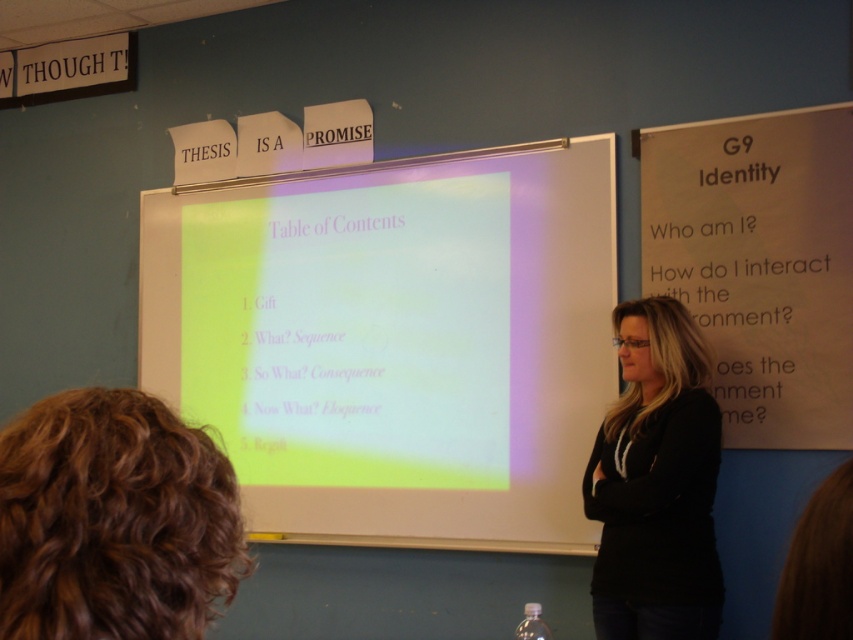
Question: Which point is farther to the camera?

Choices:
 (A) white paper at right
 (B) black cotton shirt at center
 (C) matte white projector screen at center

Answer: (C)

Question: Considering the relative positions of matte white projector screen at center and black cotton shirt at center in the image provided, where is matte white projector screen at center located with respect to black cotton shirt at center?

Choices:
 (A) left
 (B) right

Answer: (A)

Question: Can you confirm if matte white projector screen at center is positioned to the right of white paper at right?

Choices:
 (A) no
 (B) yes

Answer: (A)

Question: Which point appears closest to the camera in this image?

Choices:
 (A) (390, 336)
 (B) (663, 632)
 (C) (796, 365)

Answer: (B)

Question: Based on their relative distances, which object is farther from the black cotton shirt at center?

Choices:
 (A) matte white projector screen at center
 (B) white paper at right

Answer: (A)

Question: Is matte white projector screen at center thinner than white paper at right?

Choices:
 (A) no
 (B) yes

Answer: (A)